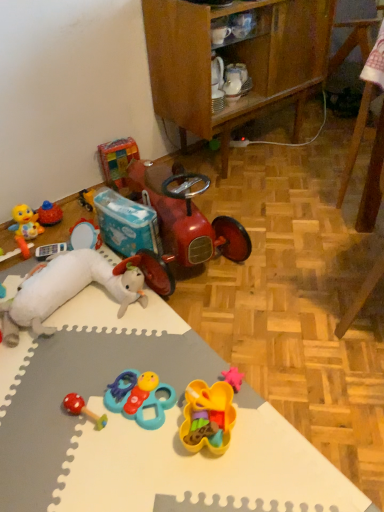
At what (x,y) coordinates should I click in order to perform the action: click on vacant area that lies between rubberized red mushroom rattle at lower left, arranged as the first toy when ordered from the bottom, and white plush toy at lower left, the 2th toy from the top. Please return your answer as a coordinate pair (x, y). The image size is (384, 512). Looking at the image, I should click on (91, 359).